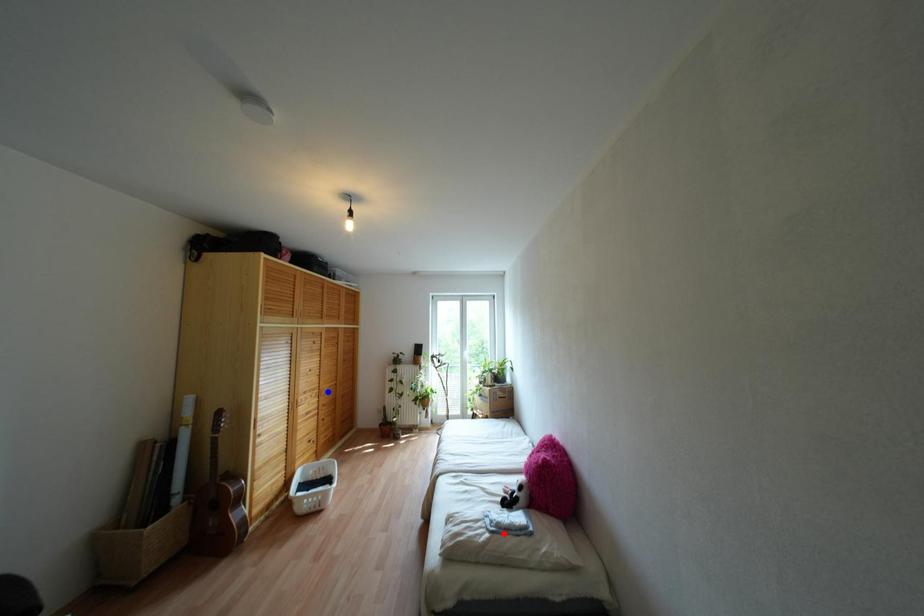
Question: In the image, two points are highlighted. Which point is nearer to the camera? Reply with the corresponding letter.

Choices:
 (A) blue point
 (B) red point

Answer: (B)